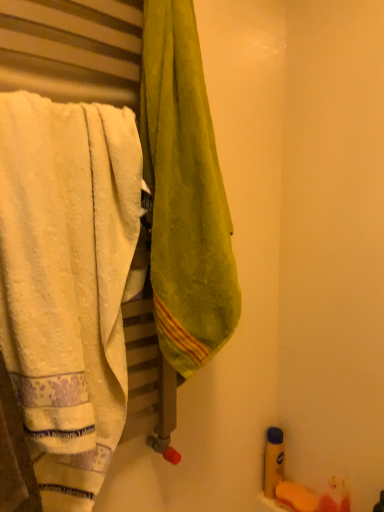
At what (x,y) coordinates should I click in order to perform the action: click on white soft towel at left, arranged as the first towel when viewed from the left. Please return your answer as a coordinate pair (x, y). Looking at the image, I should click on (67, 282).

You are a GUI agent. You are given a task and a screenshot of the screen. Output one action in this format:
    pyautogui.click(x=<x>, y=<y>)
    Task: Click on the yellow matte bottle at lower right
    This screenshot has width=384, height=512.
    Given the screenshot: What is the action you would take?
    pyautogui.click(x=273, y=461)

Find the location of `white soft towel at left, arranged as the first towel when viewed from the left`. white soft towel at left, arranged as the first towel when viewed from the left is located at coordinates (67, 282).

Considering the relative sizes of green velvety towel at center, positioned as the first towel in right-to-left order, and white soft towel at left, arranged as the first towel when viewed from the left, in the image provided, is green velvety towel at center, positioned as the first towel in right-to-left order, wider than white soft towel at left, arranged as the first towel when viewed from the left,?

Correct, the width of green velvety towel at center, positioned as the first towel in right-to-left order, exceeds that of white soft towel at left, arranged as the first towel when viewed from the left.

From the image's perspective, which is above, green velvety towel at center, the second towel positioned from the left, or white soft towel at left, arranged as the first towel when viewed from the left?

green velvety towel at center, the second towel positioned from the left, from the image's perspective.

Considering the sizes of objects green velvety towel at center, positioned as the first towel in right-to-left order, and white soft towel at left, acting as the 2th towel starting from the right, in the image provided, who is shorter, green velvety towel at center, positioned as the first towel in right-to-left order, or white soft towel at left, acting as the 2th towel starting from the right,?

white soft towel at left, acting as the 2th towel starting from the right, is shorter.

Is green velvety towel at center, the second towel positioned from the left, bigger than white soft towel at left, acting as the 2th towel starting from the right?

No, green velvety towel at center, the second towel positioned from the left, is not bigger than white soft towel at left, acting as the 2th towel starting from the right.

How different are the orientations of yellow matte bottle at lower right and white soft towel at left, arranged as the first towel when viewed from the left, in degrees?

yellow matte bottle at lower right and white soft towel at left, arranged as the first towel when viewed from the left, are facing 90.3 degrees away from each other.

Based on the photo, is yellow matte bottle at lower right turned away from white soft towel at left, arranged as the first towel when viewed from the left?

No.

In terms of width, does yellow matte bottle at lower right look wider or thinner when compared to white soft towel at left, arranged as the first towel when viewed from the left?

In the image, yellow matte bottle at lower right appears to be more narrow than white soft towel at left, arranged as the first towel when viewed from the left.

Between point (274, 434) and point (17, 300), which one is positioned in front?

The point (17, 300) is closer to the camera.

In the image, is white soft towel at left, acting as the 2th towel starting from the right, on the left side or the right side of green velvety towel at center, the second towel positioned from the left?

In the image, white soft towel at left, acting as the 2th towel starting from the right, appears on the left side of green velvety towel at center, the second towel positioned from the left.

Is point (24, 390) farther from viewer compared to point (167, 215)?

No, it is not.

Looking at this image, from the image's perspective, is white soft towel at left, acting as the 2th towel starting from the right, located above green velvety towel at center, positioned as the first towel in right-to-left order?

Actually, white soft towel at left, acting as the 2th towel starting from the right, appears below green velvety towel at center, positioned as the first towel in right-to-left order, in the image.

From the picture: From a real-world perspective, does yellow matte bottle at lower right stand above green velvety towel at center, positioned as the first towel in right-to-left order?

No, from a real-world perspective, yellow matte bottle at lower right is not over green velvety towel at center, positioned as the first towel in right-to-left order

From the image's perspective, which is below, yellow matte bottle at lower right or green velvety towel at center, the second towel positioned from the left?

yellow matte bottle at lower right appears lower in the image.

Is yellow matte bottle at lower right in front of or behind green velvety towel at center, positioned as the first towel in right-to-left order, in the image?

In the image, yellow matte bottle at lower right appears behind green velvety towel at center, positioned as the first towel in right-to-left order.

Which point is more forward, (238, 298) or (266, 464)?

Point (238, 298)

Is green velvety towel at center, the second towel positioned from the left, in contact with yellow matte bottle at lower right?

No.

Locate an element on the screen. The width and height of the screenshot is (384, 512). towel that is the 2nd one above the yellow matte bottle at lower right (from a real-world perspective) is located at coordinates (184, 193).

What's the angular difference between green velvety towel at center, the second towel positioned from the left, and yellow matte bottle at lower right's facing directions?

green velvety towel at center, the second towel positioned from the left, and yellow matte bottle at lower right are facing 90.3 degrees away from each other.

What's the angular difference between white soft towel at left, acting as the 2th towel starting from the right, and yellow matte bottle at lower right's facing directions?

There is a 90.3-degree angle between the facing directions of white soft towel at left, acting as the 2th towel starting from the right, and yellow matte bottle at lower right.

Is white soft towel at left, acting as the 2th towel starting from the right, facing away from yellow matte bottle at lower right?

No, white soft towel at left, acting as the 2th towel starting from the right, is not facing the opposite direction of yellow matte bottle at lower right.

Are white soft towel at left, acting as the 2th towel starting from the right, and yellow matte bottle at lower right beside each other?

No, white soft towel at left, acting as the 2th towel starting from the right, is not next to yellow matte bottle at lower right.

From the image's perspective, relative to yellow matte bottle at lower right, is white soft towel at left, arranged as the first towel when viewed from the left, above or below?

Clearly, from the image's perspective, white soft towel at left, arranged as the first towel when viewed from the left, is above yellow matte bottle at lower right.

The width and height of the screenshot is (384, 512). Identify the location of towel lying above the white soft towel at left, arranged as the first towel when viewed from the left (from the image's perspective). (184, 193).

Find the location of a particular element. toiletry below the white soft towel at left, arranged as the first towel when viewed from the left (from a real-world perspective) is located at coordinates (273, 461).

Based on their spatial positions, is green velvety towel at center, the second towel positioned from the left, or white soft towel at left, arranged as the first towel when viewed from the left, further from yellow matte bottle at lower right?

Among the two, white soft towel at left, arranged as the first towel when viewed from the left, is located further to yellow matte bottle at lower right.

When comparing their distances from white soft towel at left, acting as the 2th towel starting from the right, does green velvety towel at center, the second towel positioned from the left, or yellow matte bottle at lower right seem closer?

green velvety towel at center, the second towel positioned from the left, lies closer to white soft towel at left, acting as the 2th towel starting from the right, than the other object.

From the image, which object appears to be nearer to green velvety towel at center, the second towel positioned from the left, white soft towel at left, arranged as the first towel when viewed from the left, or yellow matte bottle at lower right?

white soft towel at left, arranged as the first towel when viewed from the left.

Looking at the image, which one is located closer to white soft towel at left, arranged as the first towel when viewed from the left, yellow matte bottle at lower right or green velvety towel at center, positioned as the first towel in right-to-left order?

Based on the image, green velvety towel at center, positioned as the first towel in right-to-left order, appears to be nearer to white soft towel at left, arranged as the first towel when viewed from the left.

From the image, which object appears to be farther from green velvety towel at center, positioned as the first towel in right-to-left order, yellow matte bottle at lower right or white soft towel at left, arranged as the first towel when viewed from the left?

yellow matte bottle at lower right is positioned further to the anchor green velvety towel at center, positioned as the first towel in right-to-left order.

Looking at the image, which one is located closer to yellow matte bottle at lower right, white soft towel at left, arranged as the first towel when viewed from the left, or green velvety towel at center, positioned as the first towel in right-to-left order?

green velvety towel at center, positioned as the first towel in right-to-left order.

I want to click on towel between white soft towel at left, arranged as the first towel when viewed from the left, and yellow matte bottle at lower right, along the z-axis, so click(x=184, y=193).